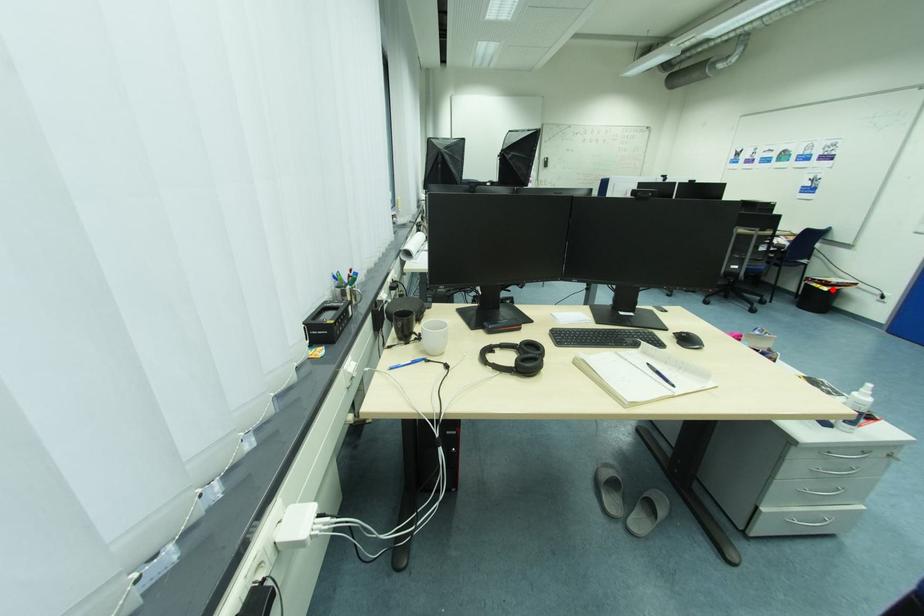
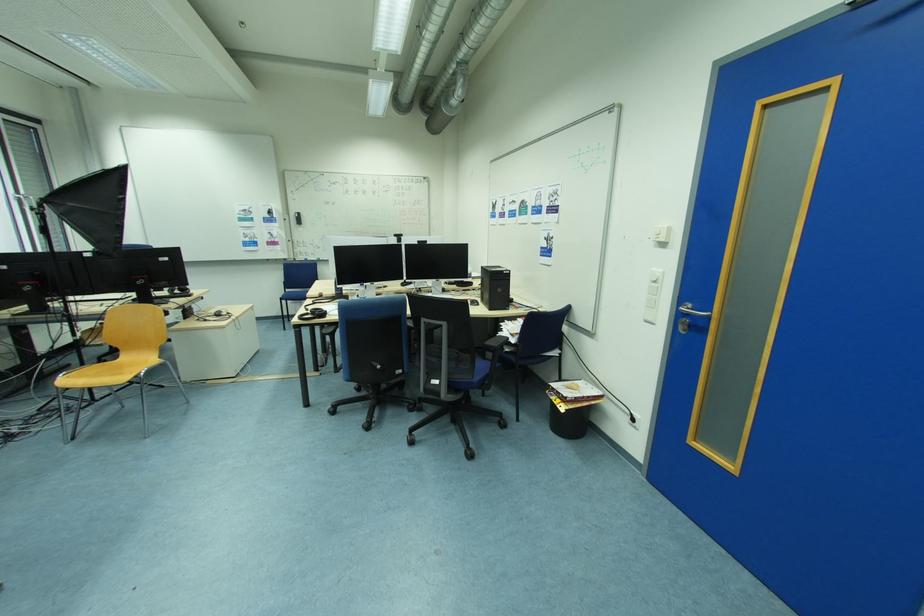
Locate, in the second image, the point that corresponds to the highlighted location in the first image.

(569, 408)